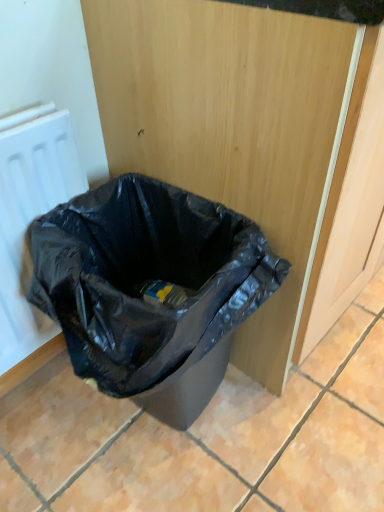
At what (x,y) coordinates should I click in order to perform the action: click on vacant area that lies to the right of black plastic bag at lower left. Please return your answer as a coordinate pair (x, y). This screenshot has height=512, width=384. Looking at the image, I should click on (316, 421).